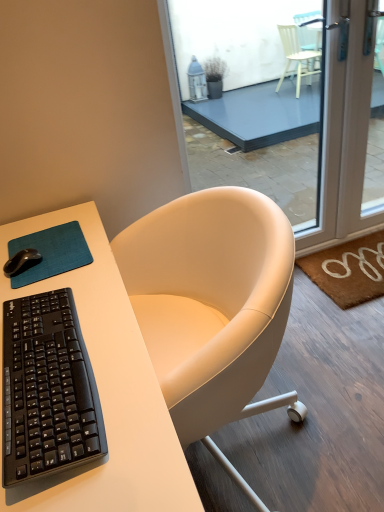
At what (x,y) coordinates should I click in order to perform the action: click on vacant area on top of black plastic keyboard at left (from a real-world perspective). Please return your answer as a coordinate pair (x, y). Looking at the image, I should click on (40, 355).